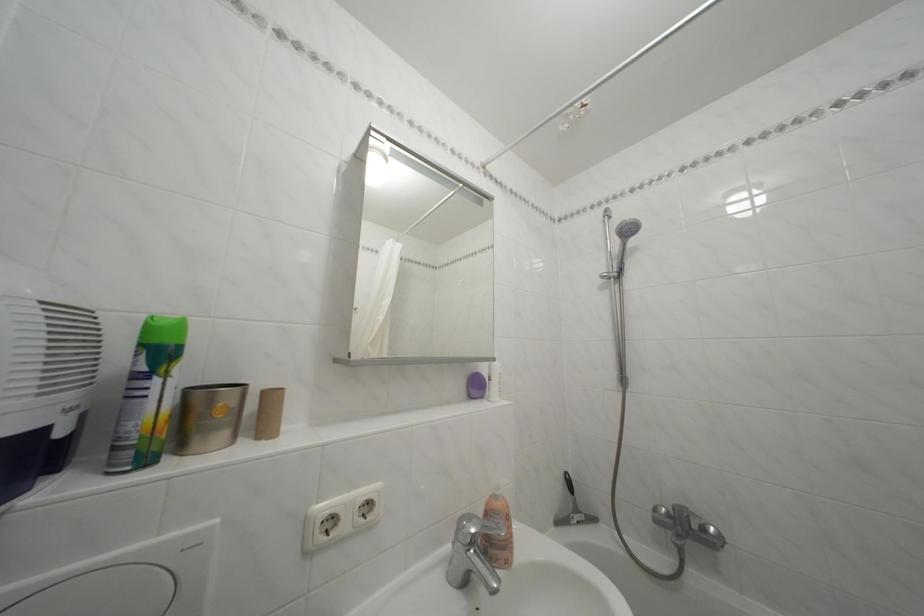
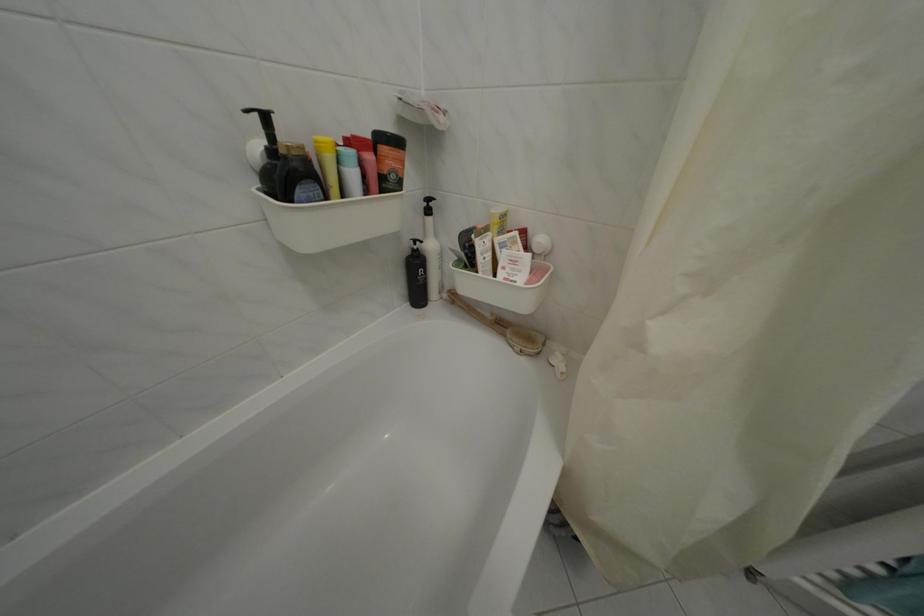
Based on the continuous images, in which direction is the camera rotating?

The camera rotated toward right-down.